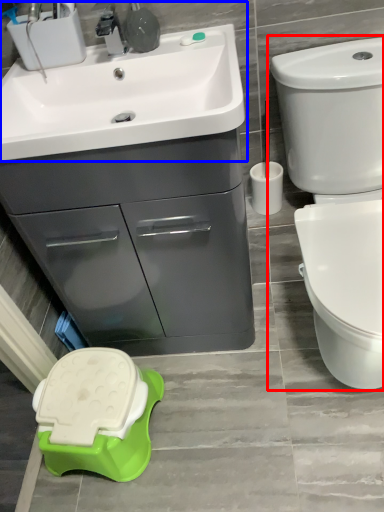
Question: Which object appears closest to the camera in this image, toilet (highlighted by a red box) or sink (highlighted by a blue box)?

Choices:
 (A) toilet
 (B) sink

Answer: (A)